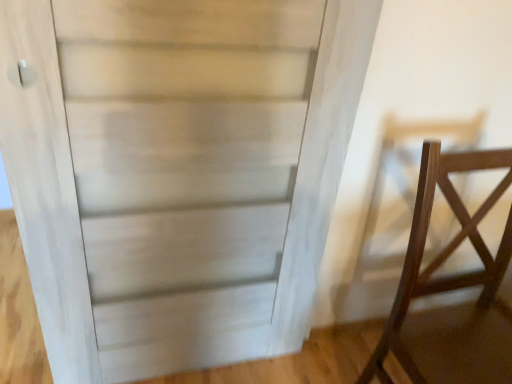
Question: Is the depth of dark wood chair at right greater than that of white wood door at center?

Choices:
 (A) no
 (B) yes

Answer: (A)

Question: From the image's perspective, does dark wood chair at right appear higher than white wood door at center?

Choices:
 (A) no
 (B) yes

Answer: (A)

Question: Can you confirm if dark wood chair at right is taller than white wood door at center?

Choices:
 (A) no
 (B) yes

Answer: (A)

Question: Can you confirm if dark wood chair at right is wider than white wood door at center?

Choices:
 (A) no
 (B) yes

Answer: (B)

Question: Is dark wood chair at right at the left side of white wood door at center?

Choices:
 (A) no
 (B) yes

Answer: (A)

Question: Can you confirm if dark wood chair at right is shorter than white wood door at center?

Choices:
 (A) no
 (B) yes

Answer: (B)

Question: Can you confirm if white wood door at center is shorter than dark wood chair at right?

Choices:
 (A) no
 (B) yes

Answer: (A)

Question: Is white wood door at center looking in the opposite direction of dark wood chair at right?

Choices:
 (A) yes
 (B) no

Answer: (B)

Question: Can you confirm if white wood door at center is positioned to the right of dark wood chair at right?

Choices:
 (A) yes
 (B) no

Answer: (B)

Question: Does white wood door at center have a larger size compared to dark wood chair at right?

Choices:
 (A) no
 (B) yes

Answer: (A)

Question: Considering the relative sizes of white wood door at center and dark wood chair at right in the image provided, is white wood door at center wider than dark wood chair at right?

Choices:
 (A) yes
 (B) no

Answer: (B)

Question: Is white wood door at center not near dark wood chair at right?

Choices:
 (A) yes
 (B) no

Answer: (B)

Question: From the image's perspective, is white wood door at center located above or below dark wood chair at right?

Choices:
 (A) below
 (B) above

Answer: (B)